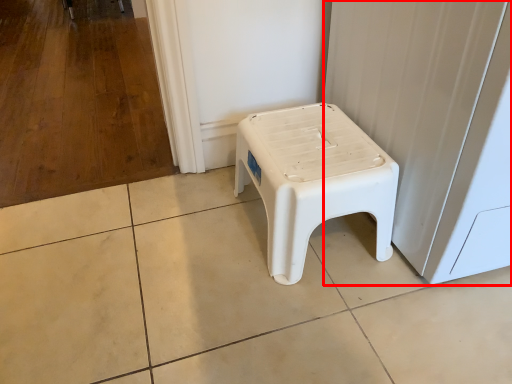
Question: Observing the image, what is the correct spatial positioning of screen door (annotated by the red box) in reference to stool?

Choices:
 (A) right
 (B) left

Answer: (A)